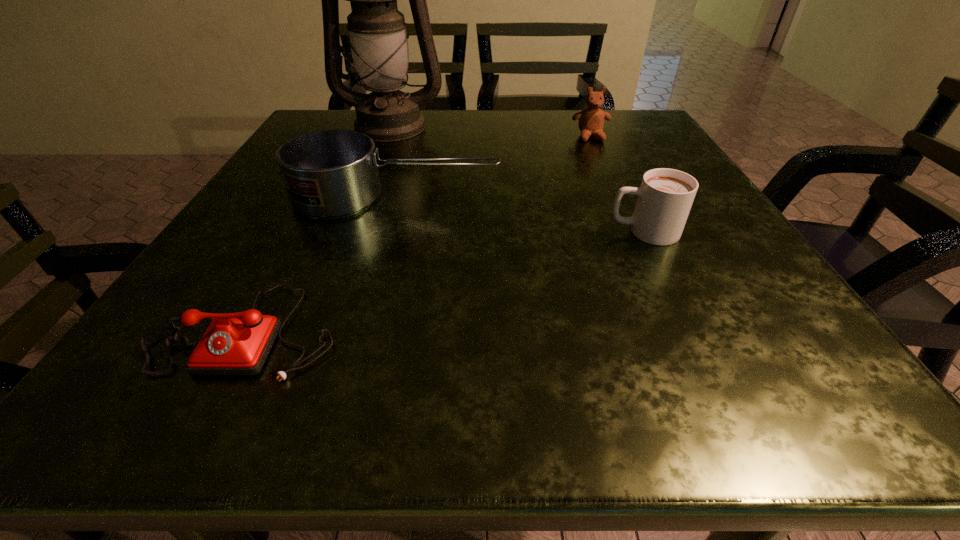
Where is `vacant region located 0.130m on the side with the handle of the cappuccino`? The image size is (960, 540). vacant region located 0.130m on the side with the handle of the cappuccino is located at coordinates (530, 232).

You are a GUI agent. You are given a task and a screenshot of the screen. Output one action in this format:
    pyautogui.click(x=<x>, y=<y>)
    Task: Click on the vacant space located 0.070m on the side with the handle of the cappuccino
    The height and width of the screenshot is (540, 960).
    Given the screenshot: What is the action you would take?
    pyautogui.click(x=565, y=232)

The image size is (960, 540). Find the location of `oil lamp that is at the far edge`. oil lamp that is at the far edge is located at coordinates (377, 30).

The width and height of the screenshot is (960, 540). I want to click on teddy bear at the far edge, so click(591, 120).

What are the coordinates of `object present at the near edge` in the screenshot? It's located at (238, 343).

This screenshot has height=540, width=960. I want to click on oil lamp present at the left edge, so click(x=377, y=30).

At what (x,y) coordinates should I click in order to perform the action: click on saucepan at the left edge. Please return your answer as a coordinate pair (x, y). Image resolution: width=960 pixels, height=540 pixels. Looking at the image, I should click on (333, 173).

What are the coordinates of `telephone situated at the left edge` in the screenshot? It's located at (238, 343).

The width and height of the screenshot is (960, 540). I want to click on teddy bear present at the right edge, so click(x=591, y=120).

Find the location of a particular element. This screenshot has width=960, height=540. cappuccino positioned at the right edge is located at coordinates (665, 196).